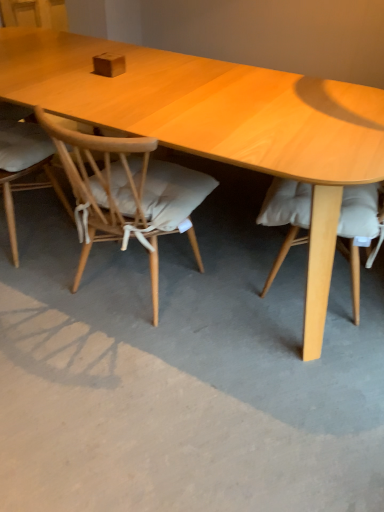
Image resolution: width=384 pixels, height=512 pixels. I want to click on blank area beneath light wood chair at center, the 1th chair viewed from the right (from a real-world perspective), so click(137, 282).